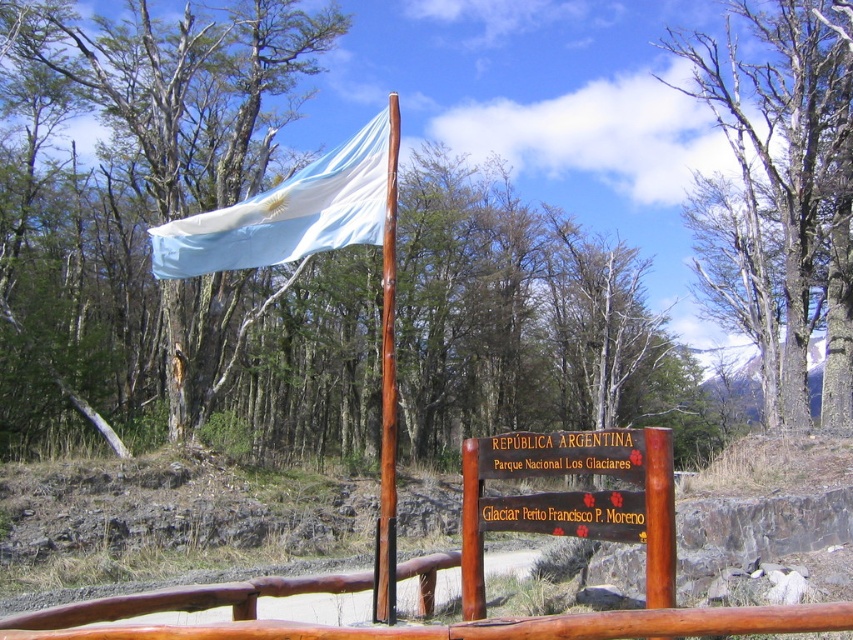
Question: Does bare wood tree at upper center appear under brown wood pole at center?

Choices:
 (A) yes
 (B) no

Answer: (B)

Question: Which point is farther to the camera?

Choices:
 (A) bare wood tree at upper center
 (B) white fabric flag at upper center

Answer: (A)

Question: Which point appears closest to the camera in this image?

Choices:
 (A) (392, 259)
 (B) (206, 198)
 (C) (363, 180)

Answer: (A)

Question: Considering the real-world distances, which object is closest to the bare wood tree at upper center?

Choices:
 (A) wooden sign at center
 (B) brown wood pole at center
 (C) smooth bark tree at upper left

Answer: (B)

Question: Does wooden sign at center have a smaller size compared to brown wood pole at center?

Choices:
 (A) yes
 (B) no

Answer: (A)

Question: Does smooth bark tree at upper left appear on the left side of bare wood tree at upper center?

Choices:
 (A) yes
 (B) no

Answer: (A)